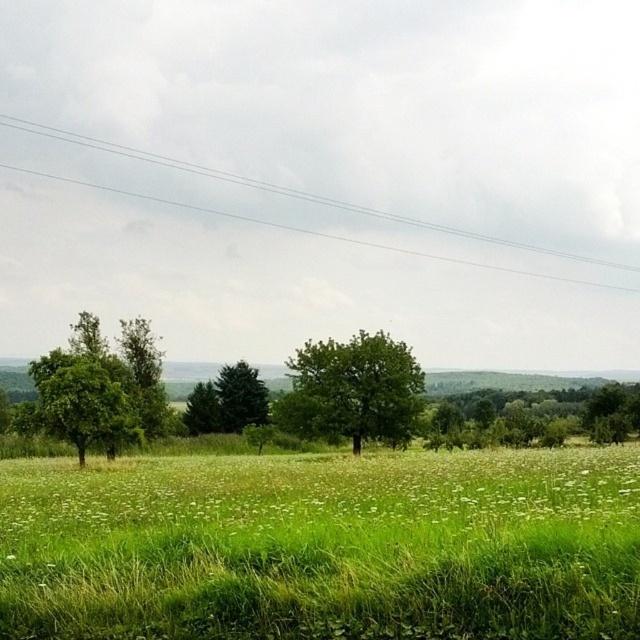
You are a bird flying over the rural landscape. You want to land on the green leafy tree at center but need to avoid the clear wire at upper center. Which object should you approach first?

The green leafy tree at center is closer to the viewer than the clear wire at upper center, so you should approach the green leafy tree at center first to land safely while avoiding the clear wire at upper center.

From the picture: You are standing in the middle of the field and see the green leafy tree at left and the green leafy tree at right. Which tree is closer to you?

The green leafy tree at left is closer to you because it is in front of the green leafy tree at right.